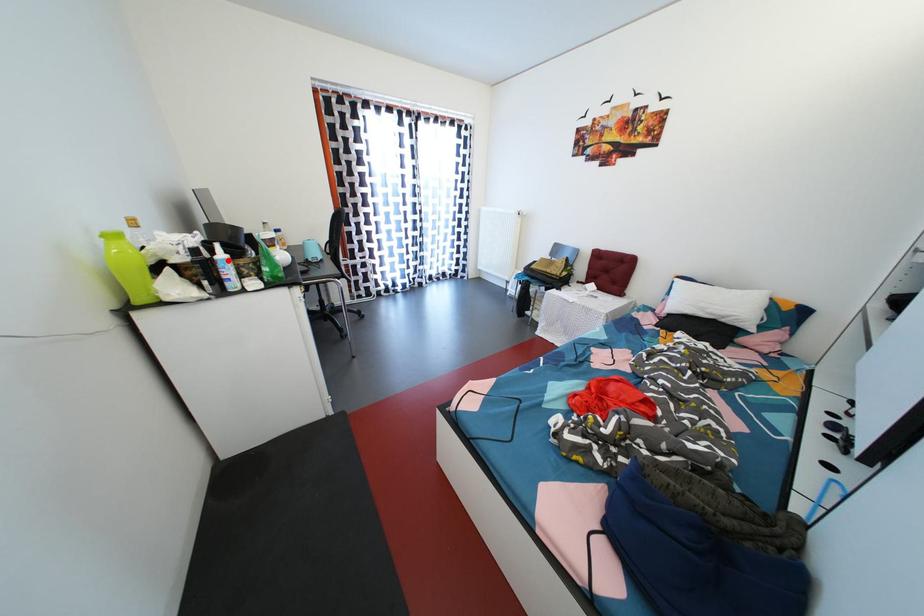
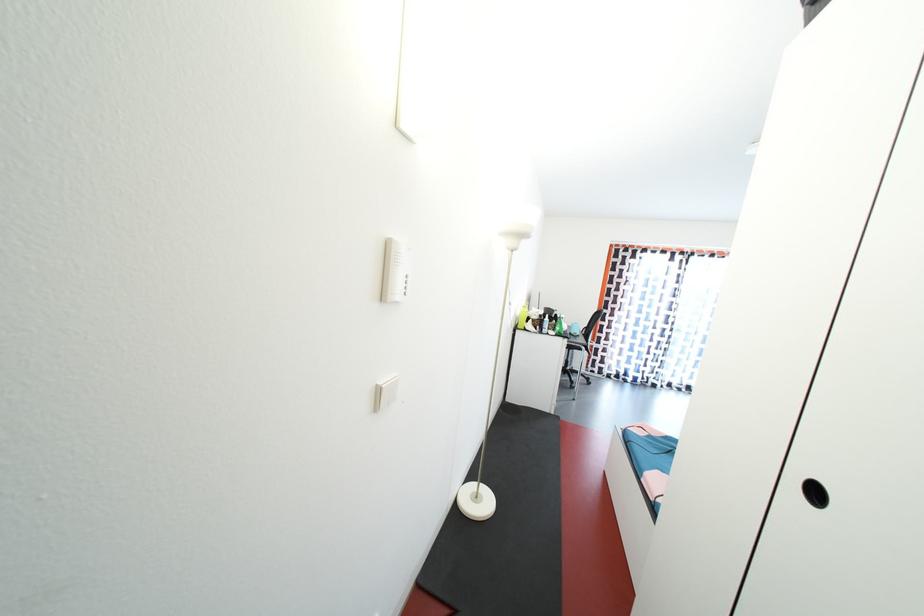
In the second image, find the point that corresponds to the highlighted location in the first image.

(553, 323)